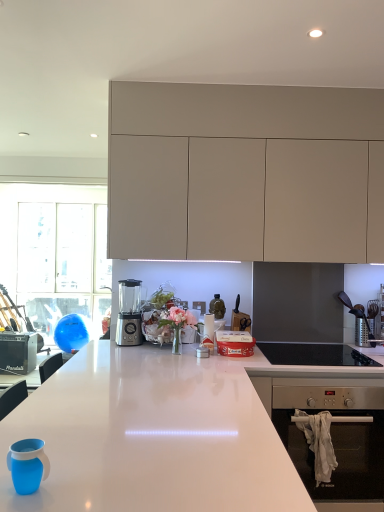
Question: From a real-world perspective, is black glass cooktop at lower right above or below matte beige cabinets at upper center?

Choices:
 (A) below
 (B) above

Answer: (A)

Question: In terms of size, does black glass cooktop at lower right appear bigger or smaller than matte beige cabinets at upper center?

Choices:
 (A) small
 (B) big

Answer: (A)

Question: Which object is positioned farthest from the white glossy countertop at center?

Choices:
 (A) matte beige cabinets at upper center
 (B) black glass cooktop at lower right
 (C) teal silicone cup at lower left
 (D) transparent glass door at left
 (E) sleek metallic blender at center

Answer: (D)

Question: Which of these objects is positioned farthest from the matte beige cabinets at upper center?

Choices:
 (A) black glass cooktop at lower right
 (B) transparent glass door at left
 (C) sleek metallic blender at center
 (D) teal silicone cup at lower left
 (E) white glossy countertop at center

Answer: (B)